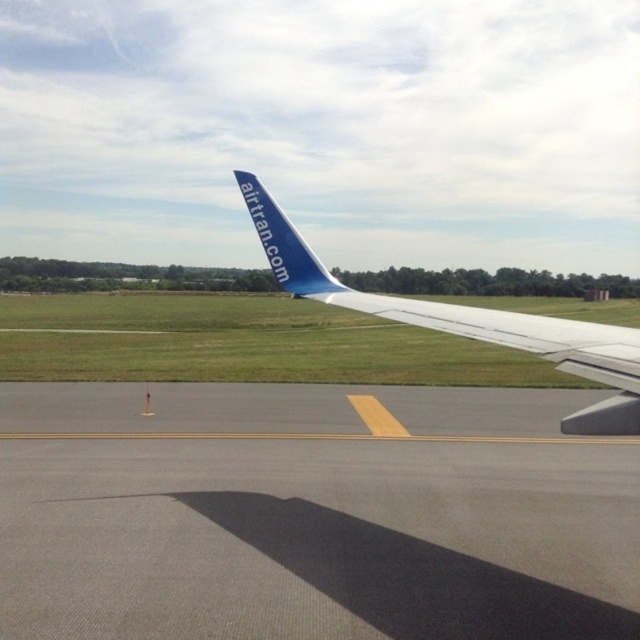
Which is above, blue painted wing at center or white matte wing at center?

Positioned higher is white matte wing at center.

Image resolution: width=640 pixels, height=640 pixels. What do you see at coordinates (467, 321) in the screenshot?
I see `blue painted wing at center` at bounding box center [467, 321].

Locate an element on the screen. Image resolution: width=640 pixels, height=640 pixels. blue painted wing at center is located at coordinates (467, 321).

Does blue painted wing at center appear on the right side of blue matte airplane tail at upper center?

Yes, blue painted wing at center is to the right of blue matte airplane tail at upper center.

Is point (262, 212) behind point (248, 193)?

No, (262, 212) is closer to viewer.

Locate an element on the screen. This screenshot has height=640, width=640. blue painted wing at center is located at coordinates (467, 321).

Image resolution: width=640 pixels, height=640 pixels. What are the coordinates of `blue painted wing at center` in the screenshot? It's located at tap(467, 321).

Between gray asphalt runway at lower center and blue painted wing at center, which one is positioned higher?

Positioned higher is blue painted wing at center.

Is gray asphalt runway at lower center smaller than blue painted wing at center?

Yes, gray asphalt runway at lower center is smaller than blue painted wing at center.

The height and width of the screenshot is (640, 640). In order to click on gray asphalt runway at lower center in this screenshot , I will do pos(312,515).